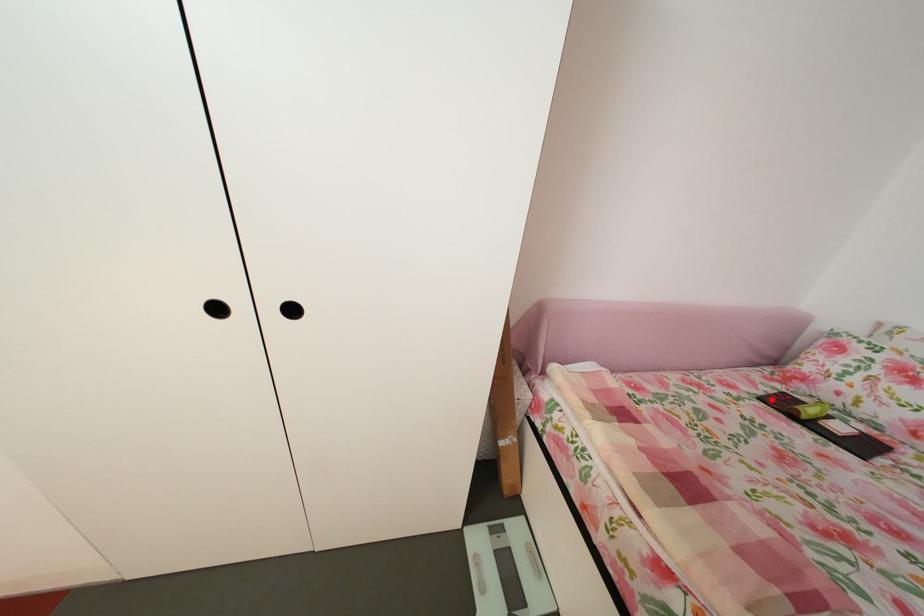
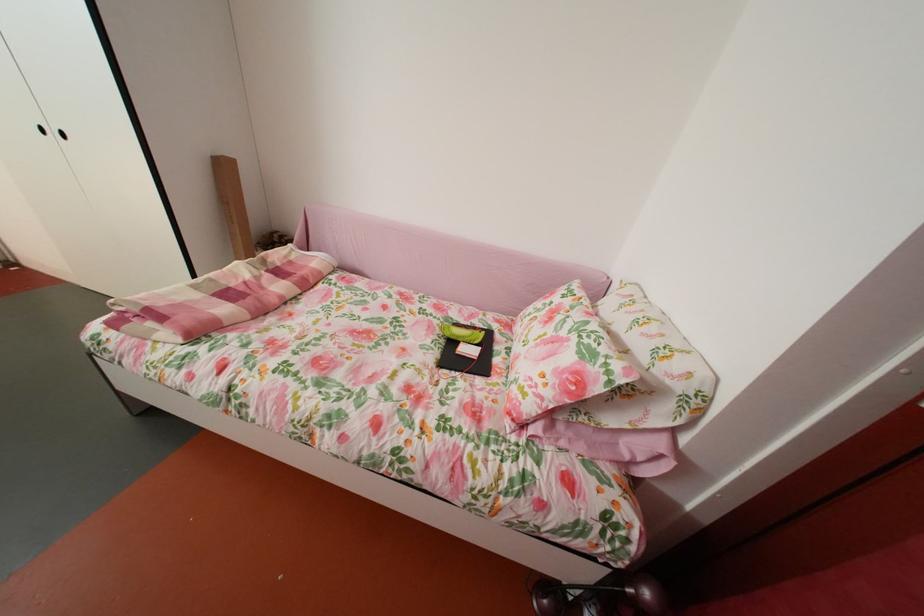
Where in the second image is the point corresponding to the highlighted location from the first image?

(473, 328)